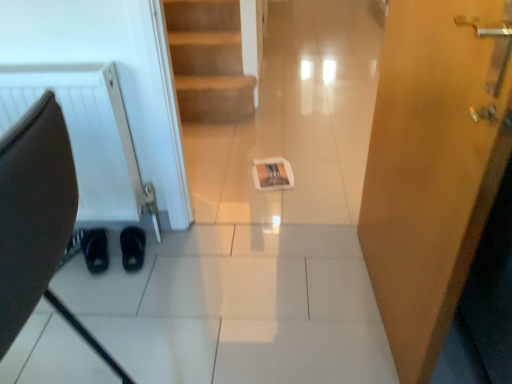
This screenshot has width=512, height=384. Identify the location of blank space situated above matte paper magazine at center (from a real-world perspective). (273, 173).